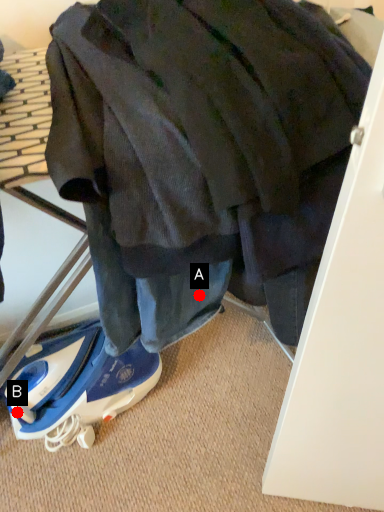
Question: Two points are circled on the image, labeled by A and B beside each circle. Which point is farther to the camera?

Choices:
 (A) A is further
 (B) B is further

Answer: (B)